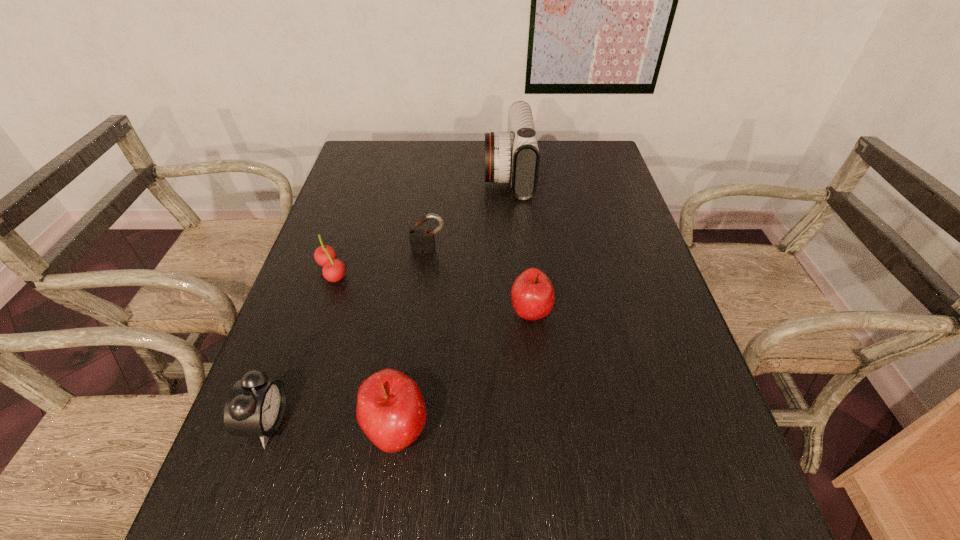
At what (x,y) coordinates should I click in order to perform the action: click on alarm clock present at the near edge. Please return your answer as a coordinate pair (x, y). The width and height of the screenshot is (960, 540). Looking at the image, I should click on (255, 406).

Where is `alarm clock that is at the left edge`? alarm clock that is at the left edge is located at coordinates (255, 406).

The image size is (960, 540). I want to click on cherry that is at the left edge, so click(x=333, y=270).

The height and width of the screenshot is (540, 960). Find the location of `object present at the near left corner`. object present at the near left corner is located at coordinates (255, 406).

You are a GUI agent. You are given a task and a screenshot of the screen. Output one action in this format:
    pyautogui.click(x=<x>, y=<y>)
    Task: Click on the free space at the far edge of the desktop
    
    Given the screenshot: What is the action you would take?
    pyautogui.click(x=406, y=176)

Where is `free space at the near edge`? The width and height of the screenshot is (960, 540). free space at the near edge is located at coordinates (401, 476).

You are a GUI agent. You are given a task and a screenshot of the screen. Output one action in this format:
    pyautogui.click(x=<x>, y=<y>)
    Task: Click on the vacant space at the left edge
    This screenshot has width=960, height=540.
    Given the screenshot: What is the action you would take?
    pyautogui.click(x=334, y=226)

The image size is (960, 540). In the image, there is a desktop. Identify the location of vacant space at the right edge. (672, 362).

Where is `free region at the far left corner of the desktop`? This screenshot has width=960, height=540. free region at the far left corner of the desktop is located at coordinates tap(358, 172).

In the image, there is a desktop. Identify the location of blank space at the far right corner. (598, 147).